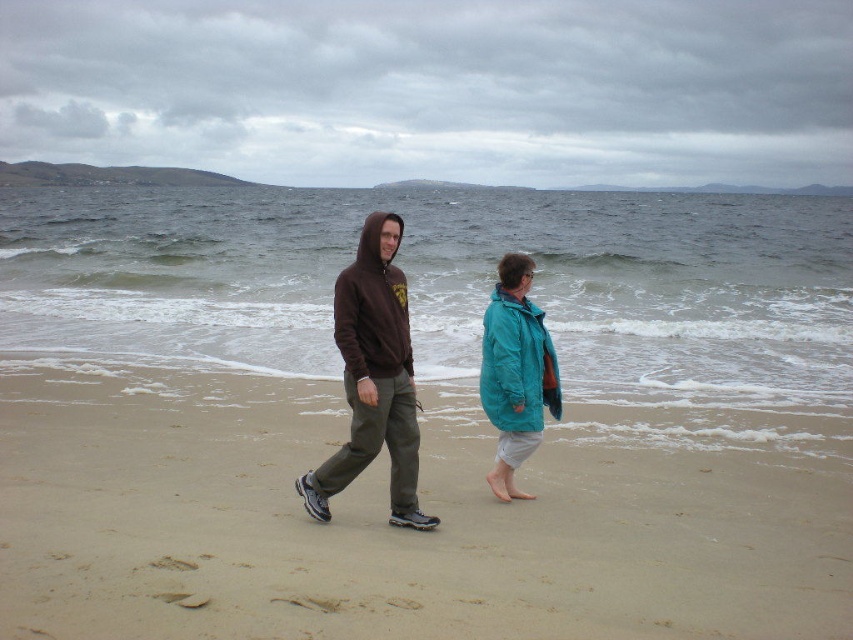
Can you confirm if sandy at center is positioned to the left of teal fabric jacket at center?

Correct, you'll find sandy at center to the left of teal fabric jacket at center.

In the scene shown: Does sandy at center appear on the right side of teal fabric jacket at center?

No, sandy at center is not to the right of teal fabric jacket at center.

Image resolution: width=853 pixels, height=640 pixels. Describe the element at coordinates (389, 528) in the screenshot. I see `sandy at center` at that location.

You are a GUI agent. You are given a task and a screenshot of the screen. Output one action in this format:
    pyautogui.click(x=<x>, y=<y>)
    Task: Click on the sandy at center
    
    Given the screenshot: What is the action you would take?
    pyautogui.click(x=389, y=528)

Who is more forward, (631, 333) or (555, 376)?

Point (555, 376) is in front.

Between point (215, 310) and point (537, 353), which one is positioned behind?

Point (215, 310)

Identify the location of grayish-blue water at center. (444, 284).

Can you confirm if brown hoodie at center is bigger than matte brown hoodie at center?

Yes.

The height and width of the screenshot is (640, 853). Describe the element at coordinates (373, 378) in the screenshot. I see `brown hoodie at center` at that location.

Who is more distant from viewer, (387,340) or (357,256)?

The point (357,256) is more distant.

Identify the location of brown hoodie at center. (373, 378).